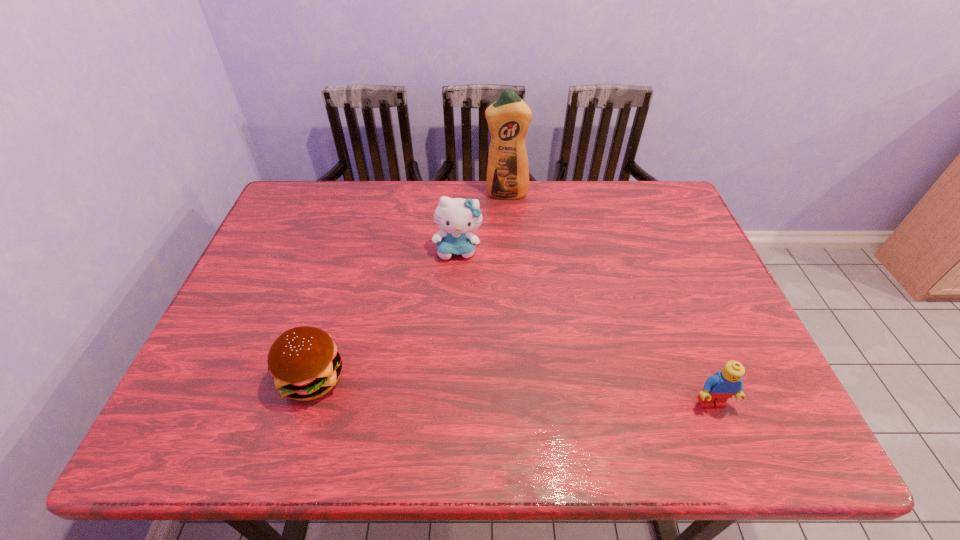
Find the location of a particular element. vacant space at the left edge of the desktop is located at coordinates (235, 329).

In the image, there is a desktop. Where is `vacant space at the right edge`? The height and width of the screenshot is (540, 960). vacant space at the right edge is located at coordinates (661, 280).

You are a GUI agent. You are given a task and a screenshot of the screen. Output one action in this format:
    pyautogui.click(x=<x>, y=<y>)
    Task: Click on the vacant space at the far left corner
    
    Given the screenshot: What is the action you would take?
    pyautogui.click(x=288, y=198)

Locate an element on the screen. This screenshot has width=960, height=540. free area in between the rightmost object and the hamburger is located at coordinates (512, 390).

Where is `free space between the Lego and the kitten`? Image resolution: width=960 pixels, height=540 pixels. free space between the Lego and the kitten is located at coordinates (585, 326).

Identify the location of free point between the leftmost object and the detergent. This screenshot has height=540, width=960. (409, 286).

Locate an element on the screen. free area in between the detergent and the rightmost object is located at coordinates coord(609,299).

The width and height of the screenshot is (960, 540). What are the coordinates of `vacant region between the tallest object and the Lego` in the screenshot? It's located at (609, 299).

This screenshot has width=960, height=540. Identify the location of free space that is in between the hamburger and the third object from right to left. (385, 314).

Image resolution: width=960 pixels, height=540 pixels. Find the location of `vacant region between the third nearest object and the leftmost object`. vacant region between the third nearest object and the leftmost object is located at coordinates (385, 314).